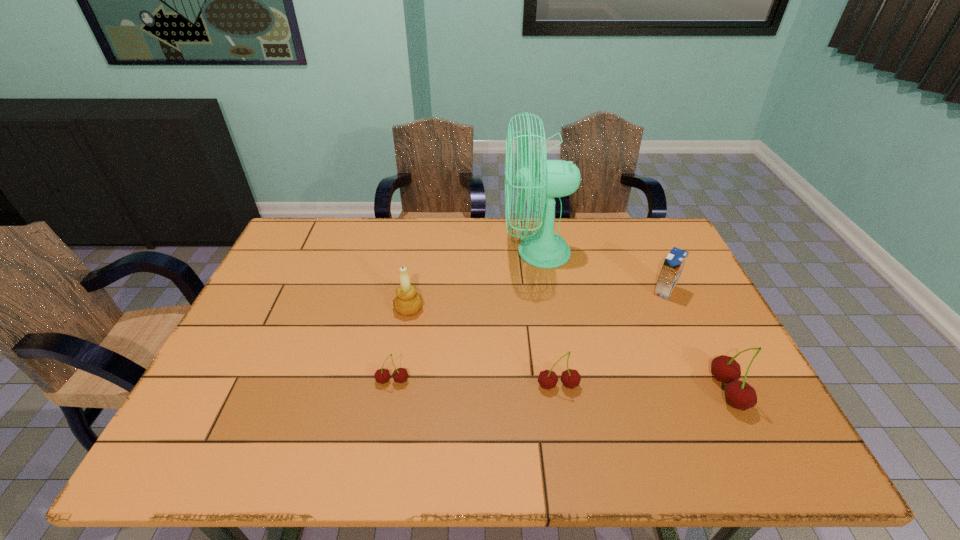
You are a GUI agent. You are given a task and a screenshot of the screen. Output one action in this format:
    pyautogui.click(x=<x>, y=<y>)
    Task: Click on the vacant area located on the surface of the tallest cherry
    Image resolution: width=960 pixels, height=540 pixels.
    Given the screenshot: What is the action you would take?
    pyautogui.click(x=556, y=391)

This screenshot has height=540, width=960. I want to click on vacant space located 0.240m in front of the tallest object to blow air, so click(x=429, y=253).

At what (x,y) coordinates should I click in order to perform the action: click on vacant space located in front of the tallest object to blow air. Please return your answer as a coordinate pair (x, y). The image size is (960, 540). Looking at the image, I should click on (404, 253).

Find the location of a particular element. vacant space located in front of the tallest object to blow air is located at coordinates (x=459, y=253).

The image size is (960, 540). What are the coordinates of `vacant space situated on the back of the candle_holder` in the screenshot? It's located at (419, 254).

Where is `vacant area situated 0.270m on the back of the orange_juice`? vacant area situated 0.270m on the back of the orange_juice is located at coordinates (636, 231).

Locate an element on the screen. The width and height of the screenshot is (960, 540). object that is positioned at the far edge is located at coordinates (545, 249).

Locate an element on the screen. This screenshot has height=540, width=960. cherry that is at the right edge is located at coordinates (740, 395).

Find the location of a particular element. orange_juice that is at the right edge is located at coordinates (674, 262).

The width and height of the screenshot is (960, 540). I want to click on object that is positioned at the near right corner, so click(740, 395).